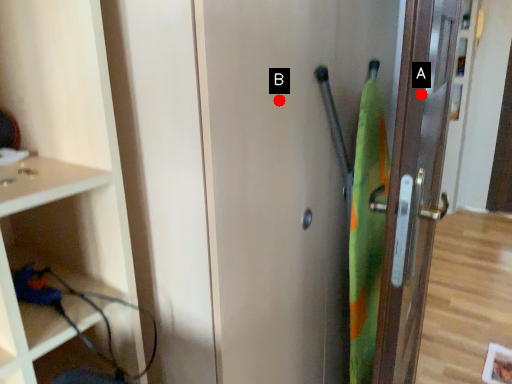
Question: Two points are circled on the image, labeled by A and B beside each circle. Which point is farther from the camera taking this photo?

Choices:
 (A) A is further
 (B) B is further

Answer: (B)